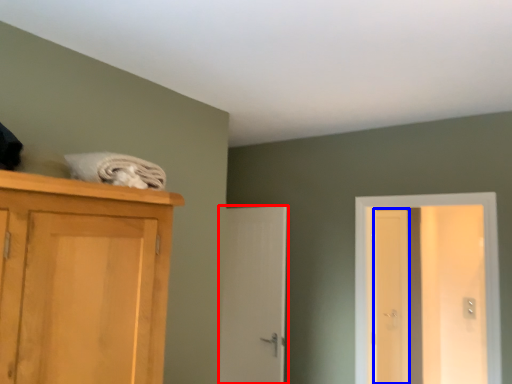
Question: Which object is further to the camera taking this photo, door (highlighted by a red box) or screen door (highlighted by a blue box)?

Choices:
 (A) door
 (B) screen door

Answer: (B)